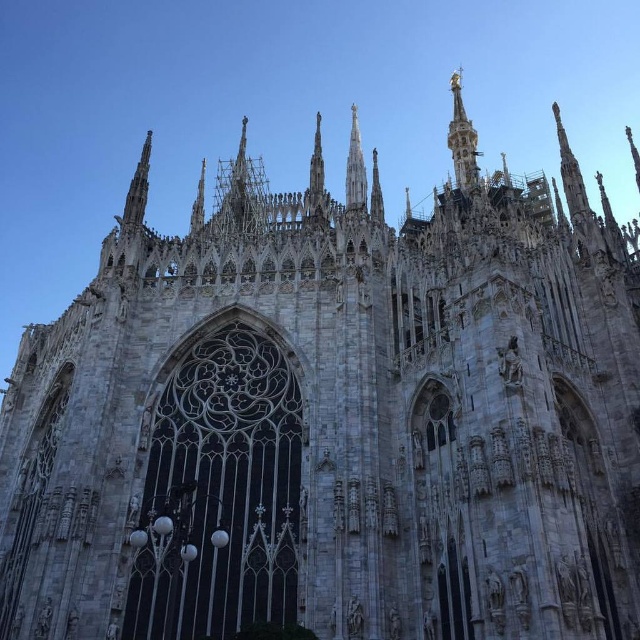
Question: Does gold polished spire at upper center appear on the right side of gray stone spire at center?

Choices:
 (A) yes
 (B) no

Answer: (A)

Question: Which point appears closest to the camera in this image?

Choices:
 (A) (348, 144)
 (B) (464, 161)

Answer: (B)

Question: Is gold polished spire at upper center to the right of gray stone spire at center from the viewer's perspective?

Choices:
 (A) yes
 (B) no

Answer: (A)

Question: Which object appears closest to the camera in this image?

Choices:
 (A) gold polished spire at upper center
 (B) gray stone spire at center

Answer: (B)

Question: Which point is closer to the camera taking this photo?

Choices:
 (A) (353, 157)
 (B) (449, 132)

Answer: (A)

Question: Can you confirm if gold polished spire at upper center is positioned to the right of gray stone spire at center?

Choices:
 (A) yes
 (B) no

Answer: (A)